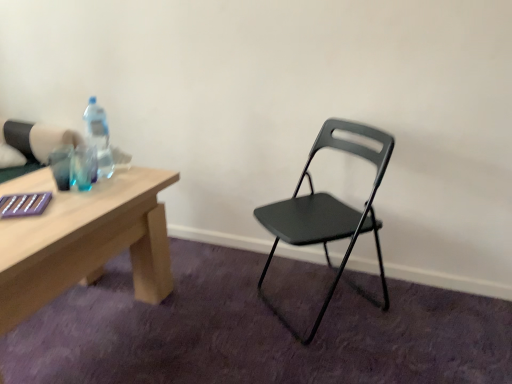
Image resolution: width=512 pixels, height=384 pixels. I want to click on free space in front of matte black folding chair at center, so click(x=329, y=359).